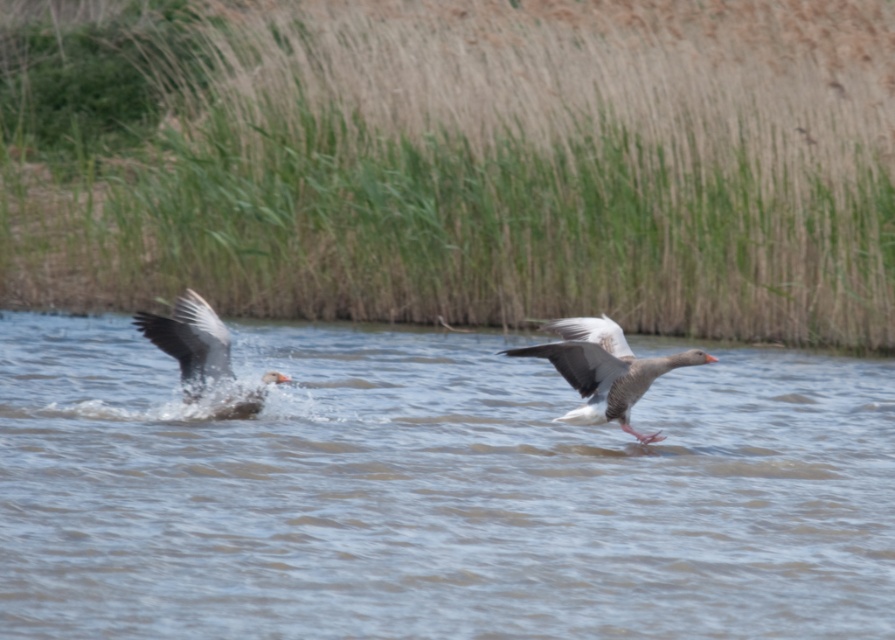
You are a birdwatcher observing two points in the sky where geese were spotted. The first point is at coordinates point (621, 397), and the second is at point (192, 387). Based on their positions, which point is closer to you?

Point (621, 397) is closer to you because it is in front of point (192, 387).

You are a birdwatcher observing two animals in the sky. You see the clear water at center and the gray matte duck at center. Which one is positioned more to the right?

The gray matte duck at center is positioned more to the right because the clear water at center is to the left of it.